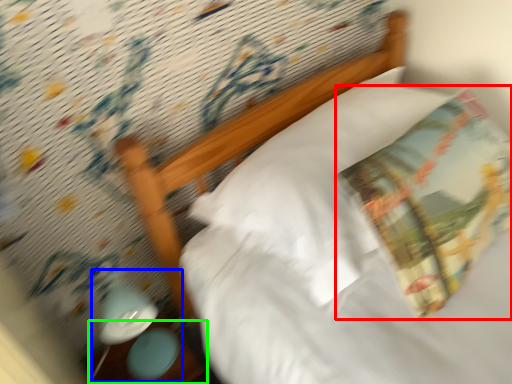
Question: Which is farther away from throw pillow (highlighted by a red box)? lamp (highlighted by a blue box) or table (highlighted by a green box)?

Choices:
 (A) lamp
 (B) table

Answer: (B)